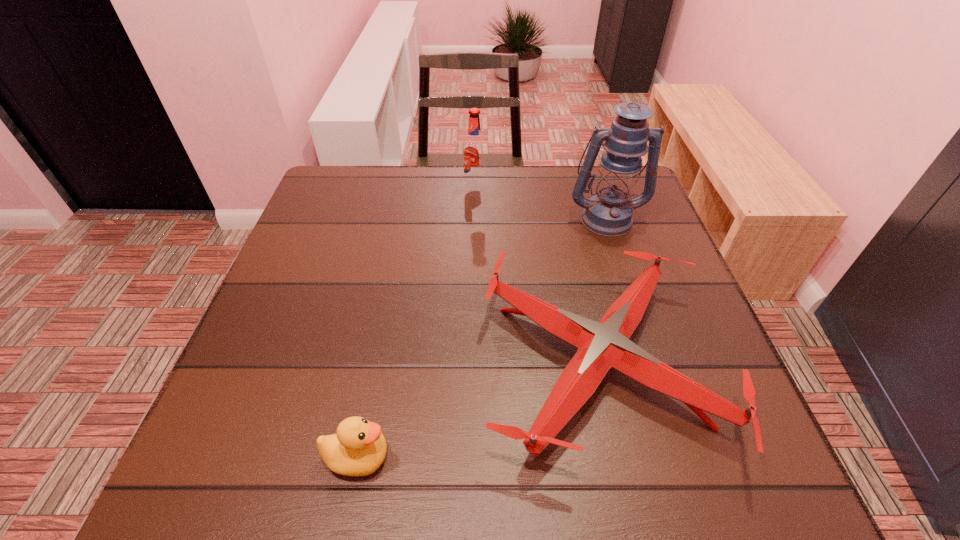
You are a GUI agent. You are given a task and a screenshot of the screen. Output one action in this format:
    pyautogui.click(x=<x>, y=<y>)
    Task: Click on the tallest object
    The height and width of the screenshot is (540, 960).
    Given the screenshot: What is the action you would take?
    pyautogui.click(x=609, y=213)

The width and height of the screenshot is (960, 540). Find the location of `lantern`. lantern is located at coordinates (609, 213).

Find the location of a particular element. This screenshot has height=540, width=960. the second tallest object is located at coordinates (474, 152).

The height and width of the screenshot is (540, 960). Identify the location of the farthest object. (474, 152).

Locate an element on the screen. duck is located at coordinates (358, 448).

Locate an element on the screen. The image size is (960, 540). drone is located at coordinates (602, 345).

The height and width of the screenshot is (540, 960). What are the coordinates of `vacant region located on the front-facing side of the lantern` in the screenshot? It's located at click(657, 372).

At what (x,y) coordinates should I click in order to perform the action: click on free space located on the front of the root beer. Please return your answer as a coordinate pair (x, y). Looking at the image, I should click on (474, 272).

Identify the location of vacant position located at the beak of the leftmost object. This screenshot has height=540, width=960. (495, 457).

Where is `blank space located 0.160m on the left of the drone`? Image resolution: width=960 pixels, height=540 pixels. blank space located 0.160m on the left of the drone is located at coordinates (399, 363).